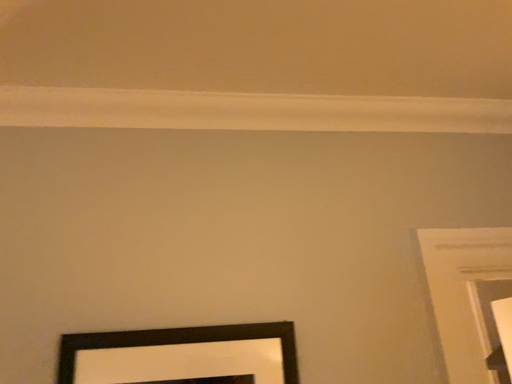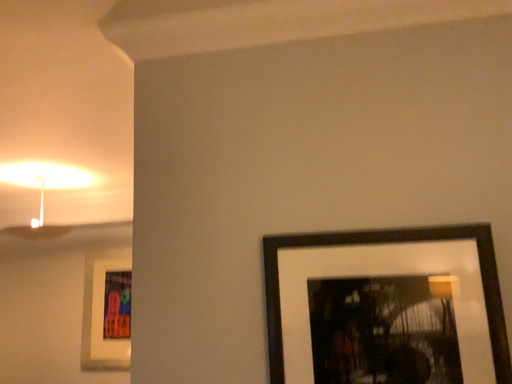
Question: Which way did the camera rotate in the video?

Choices:
 (A) rotated upward
 (B) rotated downward

Answer: (B)